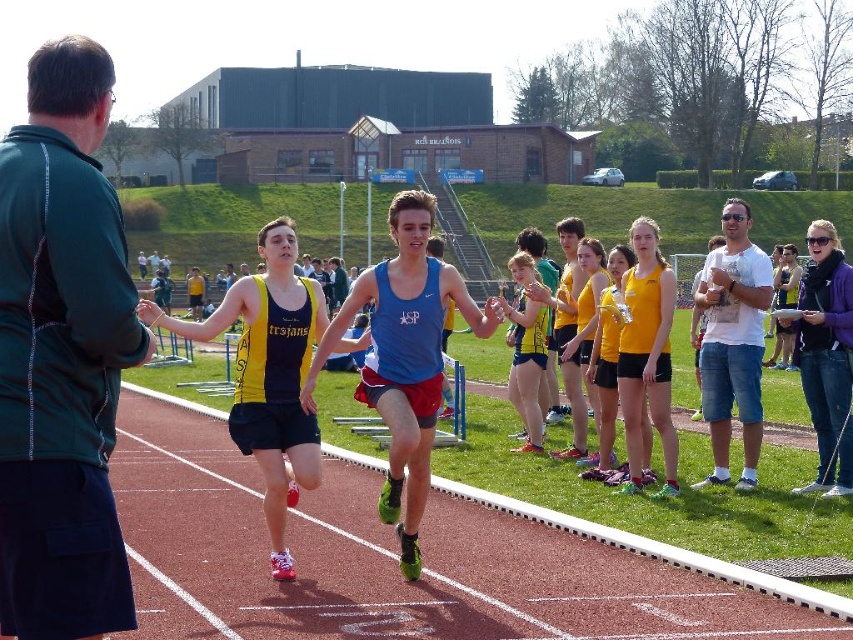
Based on the scene description, can you determine the position of the matte blue tank top at center relative to the rubberized red track at center?

The matte blue tank top at center is to the right of the rubberized red track at center.

You are a photographer positioned at the starting line of the track and field event. You want to capture a photo that includes both the matte blue tank top at center and the rubberized red track at center. Based on their sizes, which object will appear larger in the photo?

The matte blue tank top at center is much taller than the rubberized red track at center, so it will appear larger in the photo.

Based on the photo, you are a photographer standing at the edge of the rubberized red track at center. You want to capture a closeup shot of the yellow matte tank top at center. Given that your camera has a maximum focus range of 10 feet, will you be able to get a clear photo?

The yellow matte tank top at center is 13.37 feet away from the rubberized red track at center. Since your camera can only focus up to 10 feet, you won t be able to get a clear photo.